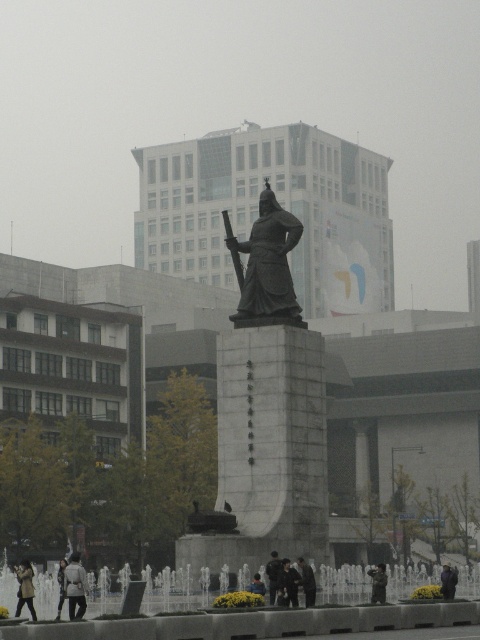
Question: Can you confirm if dark gray jacket at center is bigger than blue denim jacket at center?

Choices:
 (A) yes
 (B) no

Answer: (A)

Question: Which object is positioned closest to the dark gray jacket at center?

Choices:
 (A) bronze statue at center
 (B) light gray coat at center
 (C) blue denim jacket at center

Answer: (C)

Question: Does bronze statue at center lie behind dark gray uniform at center?

Choices:
 (A) no
 (B) yes

Answer: (B)

Question: Is light gray jacket at lower left thinner than dark gray jacket at center?

Choices:
 (A) no
 (B) yes

Answer: (A)

Question: Which of the following is the closest to the observer?

Choices:
 (A) (445, 595)
 (B) (265, 260)

Answer: (A)

Question: Which object is positioned farthest from the polished bronze statue at center?

Choices:
 (A) light gray jacket at lower left
 (B) dark gray uniform at center

Answer: (A)